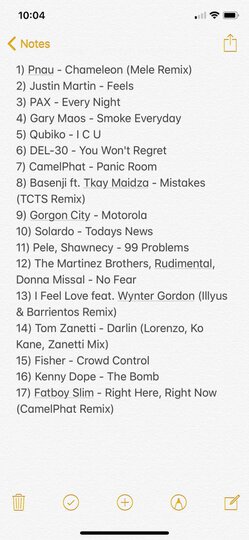
This screenshot has width=249, height=540. I want to click on clock, so click(28, 16).